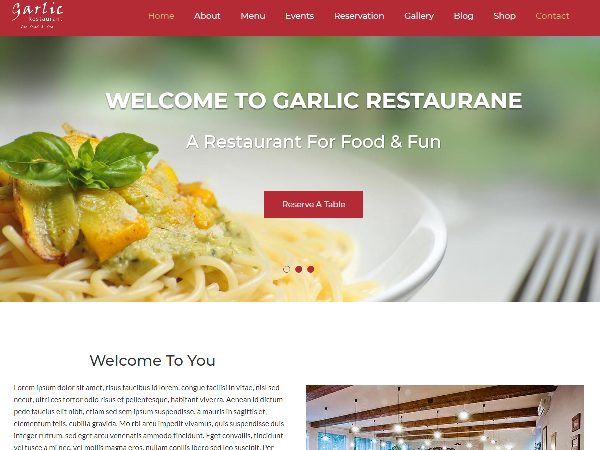
What are the coordinates of `photo frames` in the screenshot? It's located at (577, 420), (576, 443), (553, 445), (544, 439).